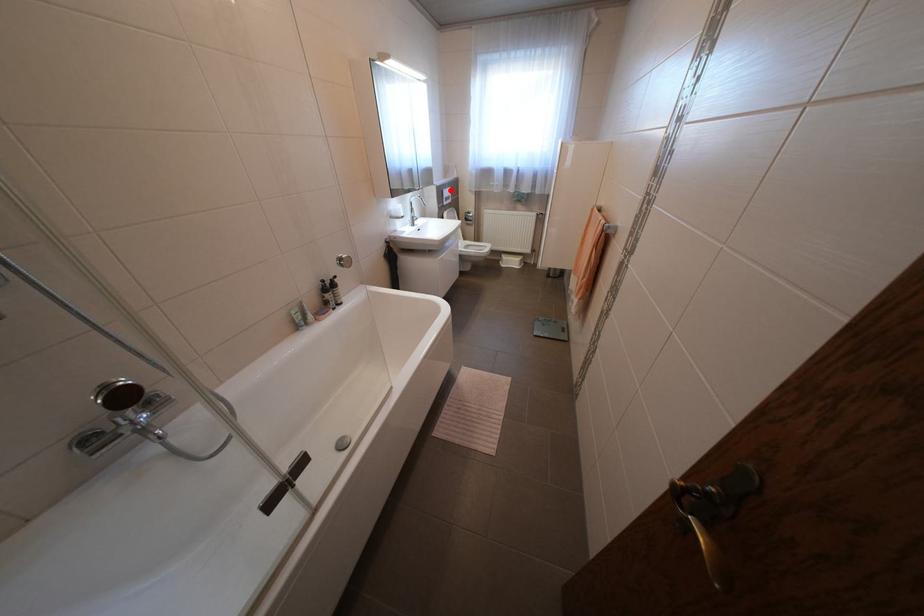
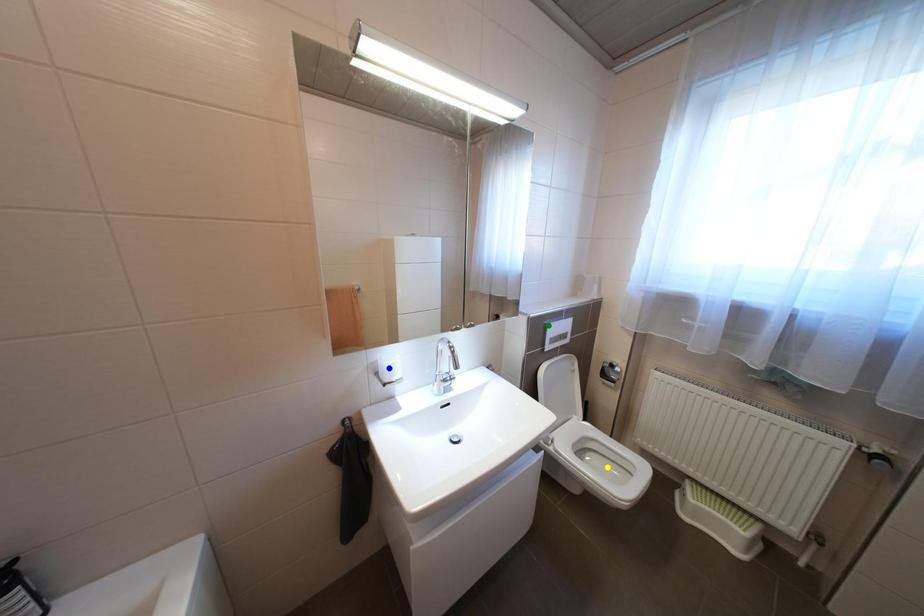
Question: I am providing you with two images of the same scene from different viewpoints. A red point is marked on the first image. You are given multiple points on the second image. Which spot in image 2 lines up with the point in image 1?

Choices:
 (A) yellow point
 (B) blue point
 (C) green point

Answer: (C)